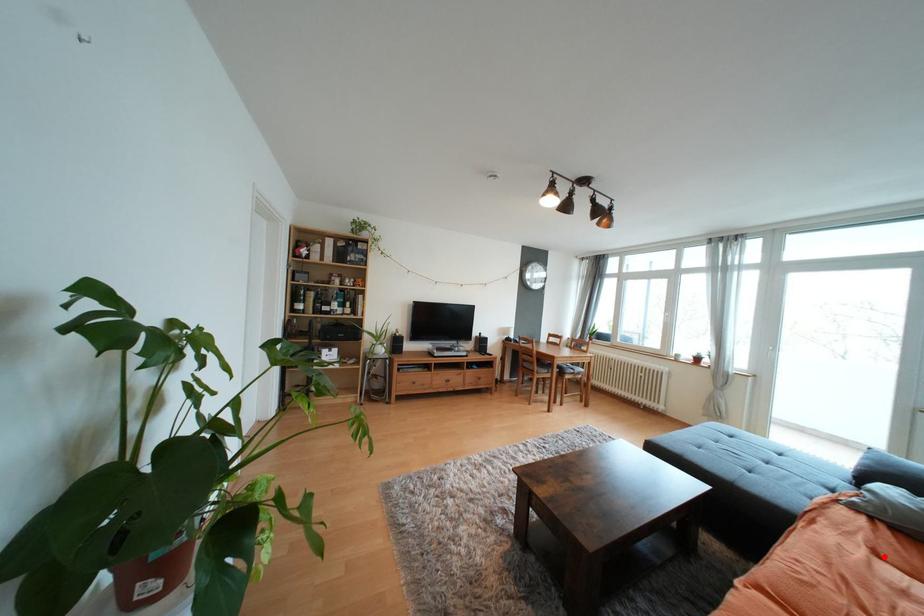
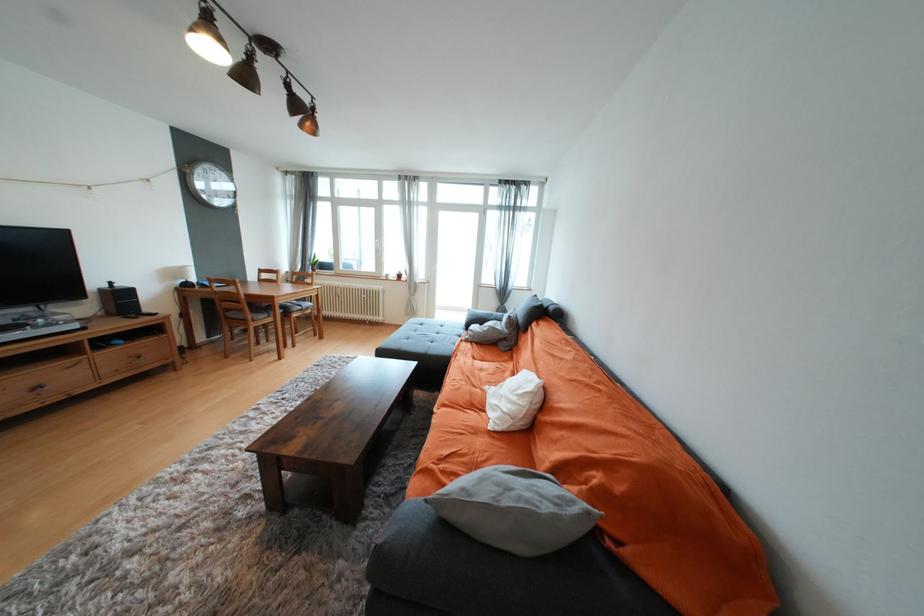
Question: I am providing you with two images of the same scene from different viewpoints. In image1, a red point is highlighted. Considering the same 3D point in image2, which of the following is correct?

Choices:
 (A) It is closer
 (B) It is farther

Answer: (A)